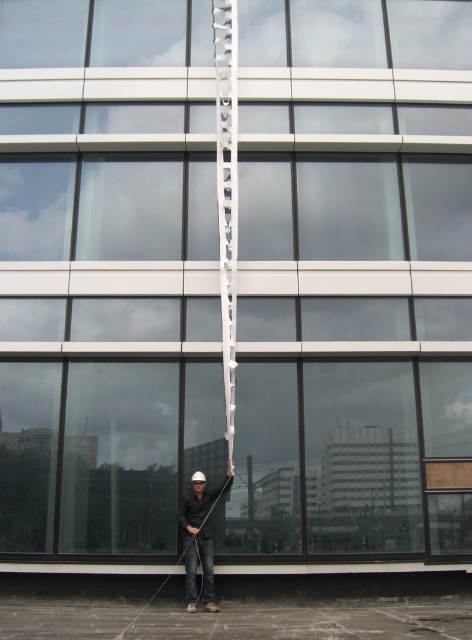
Does white metallic ladder at center have a lesser width compared to black matte rope at center?

Yes, white metallic ladder at center is thinner than black matte rope at center.

Does white metallic ladder at center have a smaller size compared to black matte rope at center?

Yes.

What are the coordinates of `white metallic ladder at center` in the screenshot? It's located at (227, 192).

Describe the element at coordinates (200, 536) in the screenshot. I see `matte black shirt at center` at that location.

Find the location of `matte black shirt at center`. matte black shirt at center is located at coordinates (200, 536).

At what (x,y) coordinates should I click in order to perform the action: click on matte black shirt at center. Please return your answer as a coordinate pair (x, y). Looking at the image, I should click on 200,536.

Between white metallic ladder at center and matte black shirt at center, which one is positioned higher?

Positioned higher is white metallic ladder at center.

Who is more distant from viewer, (219, 196) or (183, 524)?

Positioned behind is point (219, 196).

Which is in front, point (235, 236) or point (224, 492)?

Positioned in front is point (224, 492).

This screenshot has width=472, height=640. Identify the location of white metallic ladder at center. (227, 192).